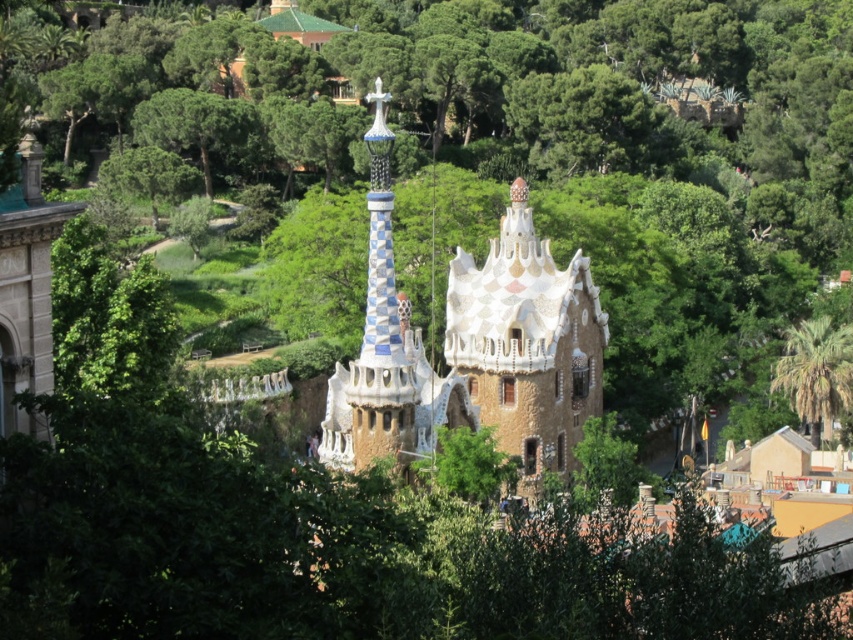
Question: Which of the following is the closest to the observer?

Choices:
 (A) green leafy palm tree at right
 (B) white mosaic tower at center
 (C) white mosaic spire at center

Answer: (C)

Question: Can you confirm if white mosaic tower at center is smaller than white mosaic spire at center?

Choices:
 (A) yes
 (B) no

Answer: (B)

Question: Can you confirm if white mosaic spire at center is smaller than green leafy palm tree at right?

Choices:
 (A) no
 (B) yes

Answer: (B)

Question: Estimate the real-world distances between objects in this image. Which object is farther from the white mosaic spire at center?

Choices:
 (A) white mosaic tower at center
 (B) green leafy palm tree at right

Answer: (B)

Question: Can you confirm if white mosaic tower at center is smaller than green leafy palm tree at right?

Choices:
 (A) yes
 (B) no

Answer: (A)

Question: Based on their relative distances, which object is nearer to the white mosaic spire at center?

Choices:
 (A) green leafy palm tree at right
 (B) white mosaic tower at center

Answer: (B)